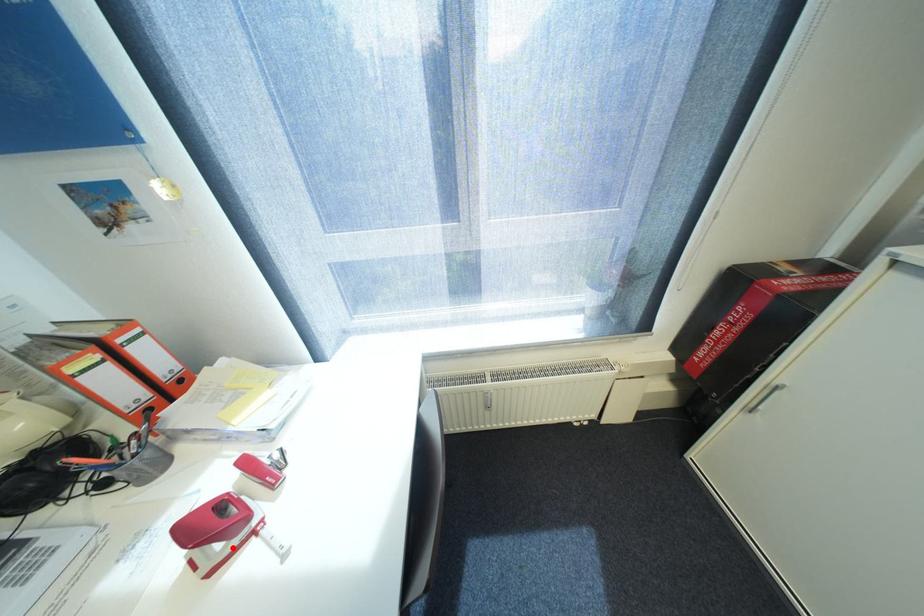
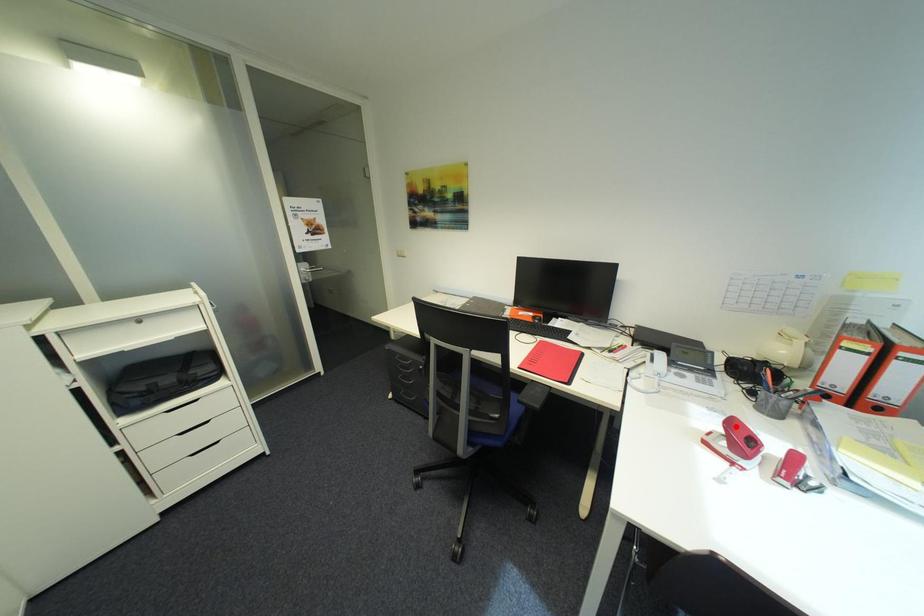
I am providing you with two images of the same scene from different viewpoints. A red point is marked on the first image and another point is marked on the second image. Does the point marked in image1 correspond to the same location as the one in image2?

No